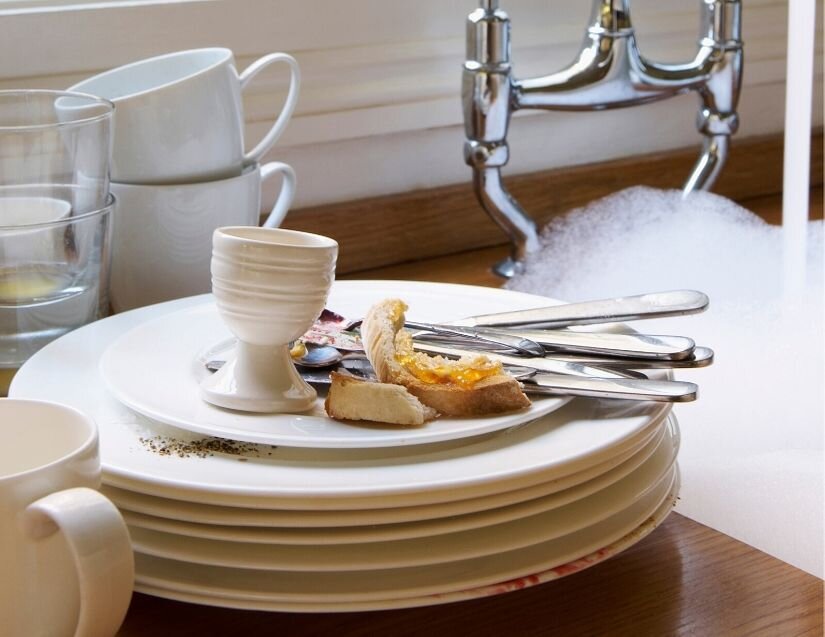
Find the location of a particular element. Image resolution: width=825 pixels, height=637 pixels. rim of plate is located at coordinates (536, 581), (554, 562), (540, 539), (530, 512), (511, 502), (505, 488), (517, 471), (435, 436).